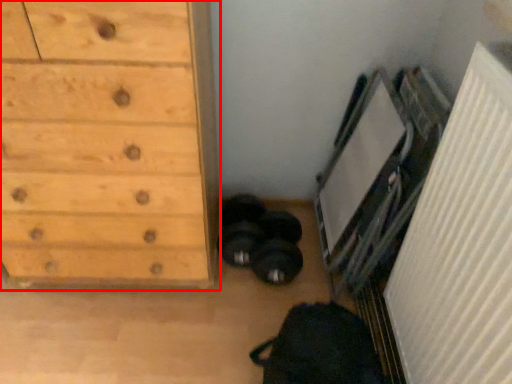
Question: Where is chest of drawers (annotated by the red box) located in relation to radiator in the image?

Choices:
 (A) right
 (B) left

Answer: (B)